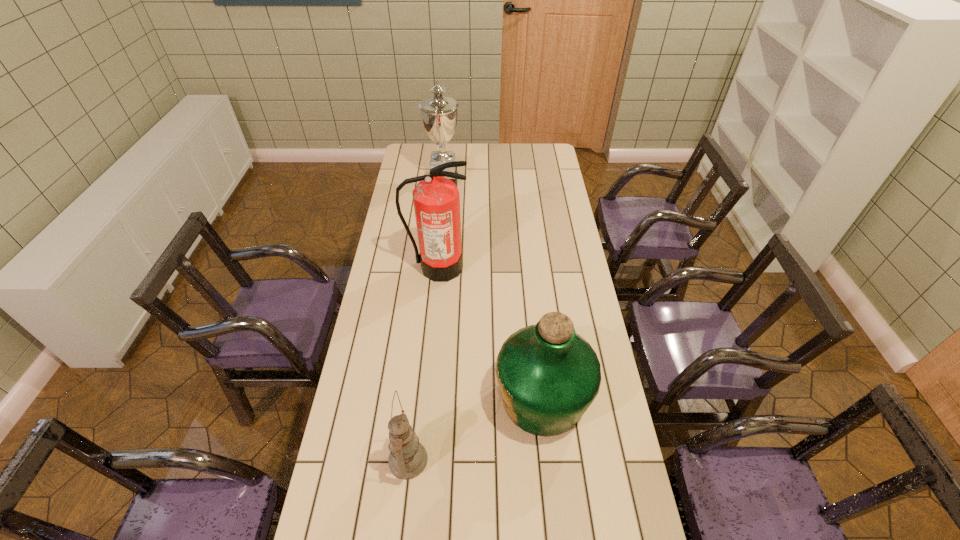
Locate an element on the screen. This screenshot has width=960, height=540. the farthest object is located at coordinates tap(439, 113).

At what (x,y) coordinates should I click in order to perform the action: click on the third nearest object. Please return your answer as a coordinate pair (x, y). Looking at the image, I should click on (436, 199).

Image resolution: width=960 pixels, height=540 pixels. I want to click on liquor, so click(x=548, y=375).

The image size is (960, 540). Find the location of `the shortest object`. the shortest object is located at coordinates (408, 458).

Locate an element on the screen. The image size is (960, 540). vacant area located 0.090m at the front view of the farthest object is located at coordinates (480, 180).

This screenshot has width=960, height=540. I want to click on free space located 0.290m on the front side of the fire extinguisher, so click(x=430, y=345).

Identify the location of vacant area located 0.300m on the label side of the liquor. (396, 399).

Where is `free space located 0.210m on the label side of the liquor`? This screenshot has width=960, height=540. free space located 0.210m on the label side of the liquor is located at coordinates (425, 399).

The image size is (960, 540). Find the location of `free location located on the label side of the liquor`. free location located on the label side of the liquor is located at coordinates (363, 399).

The image size is (960, 540). I want to click on free region located 0.090m on the back of the oil lamp, so click(414, 407).